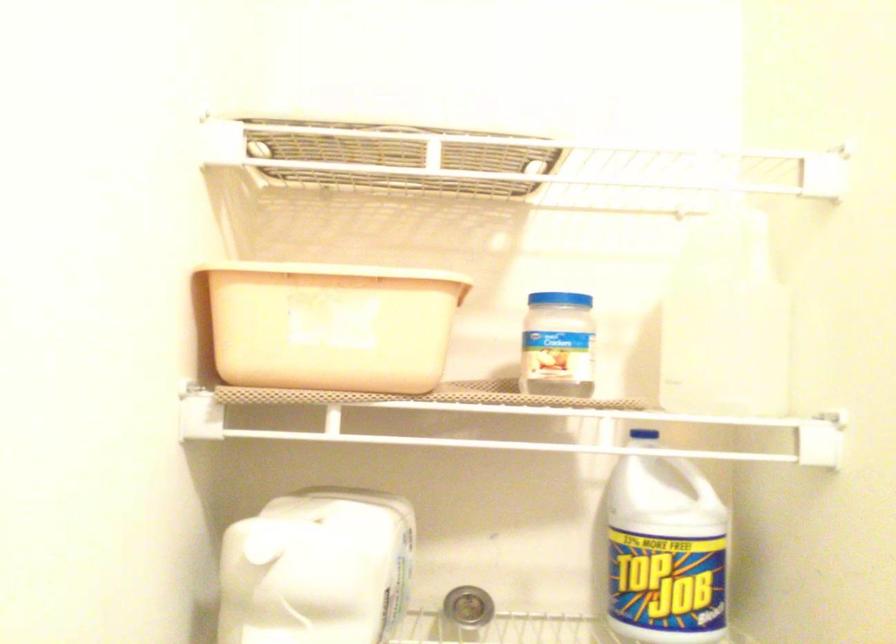
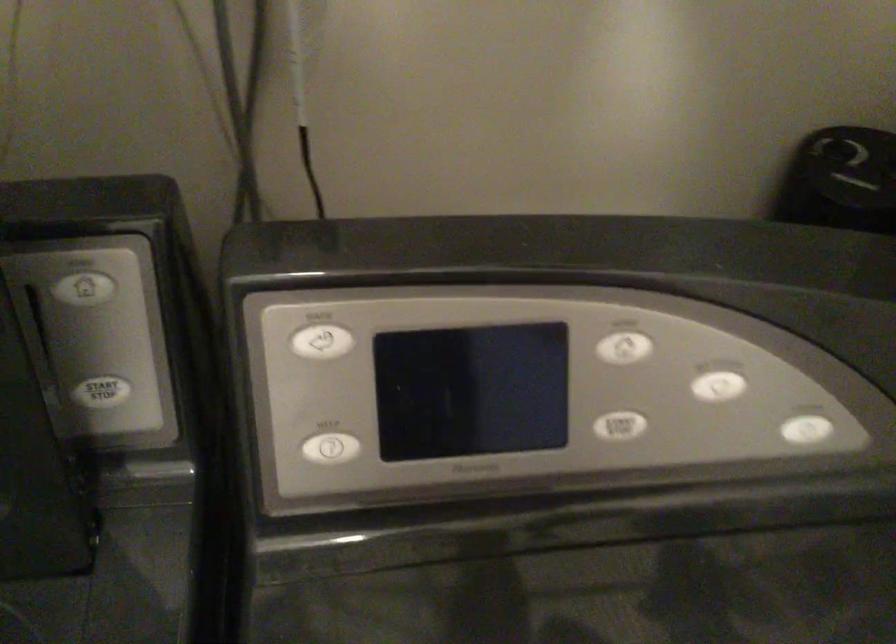
Based on the continuous images, in which direction is the camera rotating?

The rotation direction of the camera is right-down.